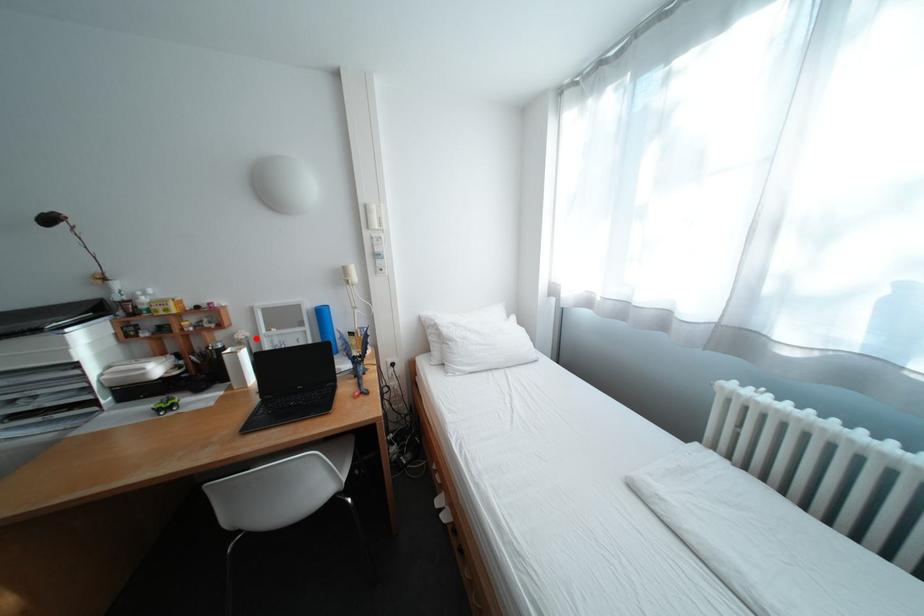
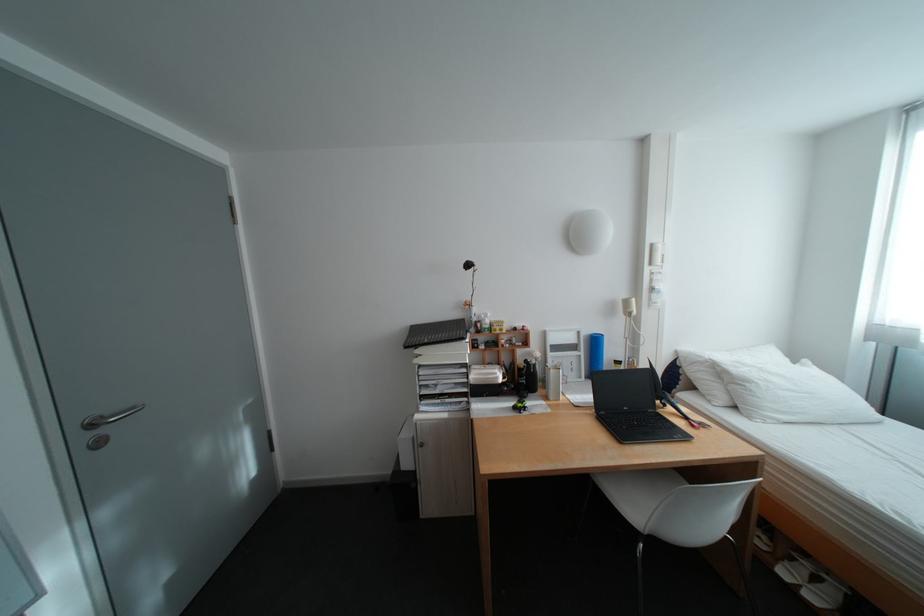
The point at the highlighted location is marked in the first image. Where is the corresponding point in the second image?

(552, 358)